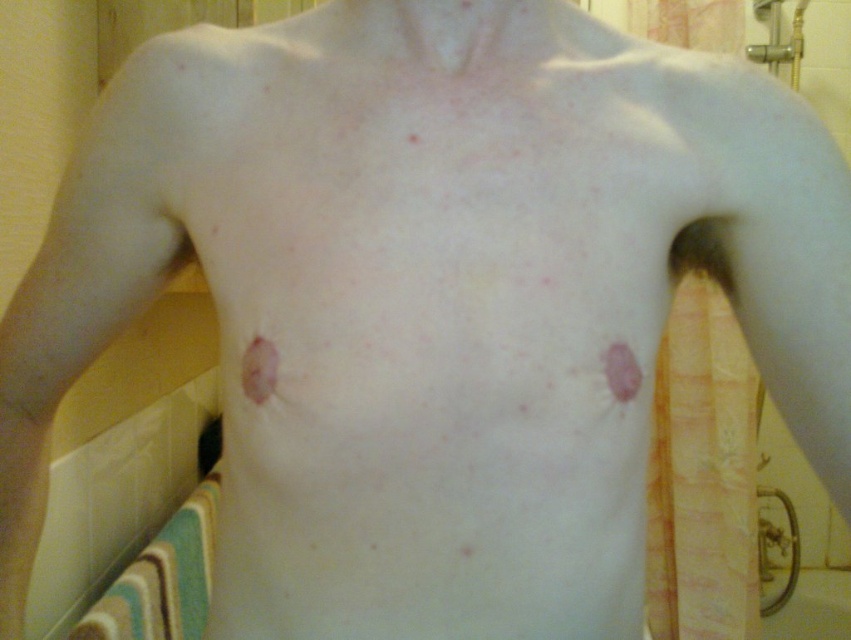
Describe the element at coordinates (260, 369) in the screenshot. The height and width of the screenshot is (640, 851). I see `pink matte mole at center` at that location.

Is point (260, 348) behind point (623, 358)?

Yes.

Who is more forward, (260, 348) or (621, 380)?

Point (621, 380)

Locate an element on the screen. This screenshot has height=640, width=851. pink matte mole at center is located at coordinates point(260,369).

Between metallic silver shower at upper right and pink matte mole at center, which one has more height?

Standing taller between the two is metallic silver shower at upper right.

Which is above, metallic silver shower at upper right or pink matte mole at center?

Positioned higher is metallic silver shower at upper right.

The image size is (851, 640). What are the coordinates of `metallic silver shower at upper right` in the screenshot? It's located at (778, 38).

From the picture: Who is lower down, metallic silver shower at upper right or pink matte patch at upper right?

Positioned lower is pink matte patch at upper right.

Between metallic silver shower at upper right and pink matte patch at upper right, which one has less height?

With less height is pink matte patch at upper right.

Measure the distance between metallic silver shower at upper right and camera.

The distance of metallic silver shower at upper right from camera is 2.25 meters.

Locate an element on the screen. metallic silver shower at upper right is located at coordinates (778, 38).